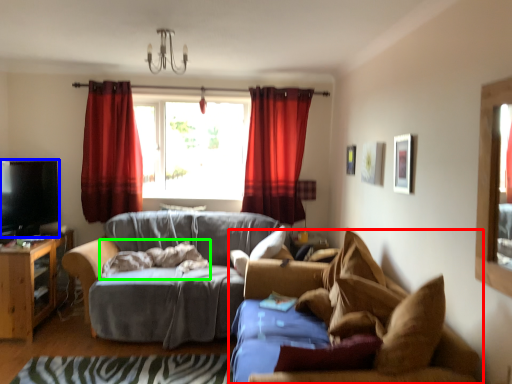
Question: Estimate the real-world distances between objects in this image. Which object is farther from studio couch (highlighted by a red box), television (highlighted by a blue box) or blanket (highlighted by a green box)?

Choices:
 (A) television
 (B) blanket

Answer: (A)